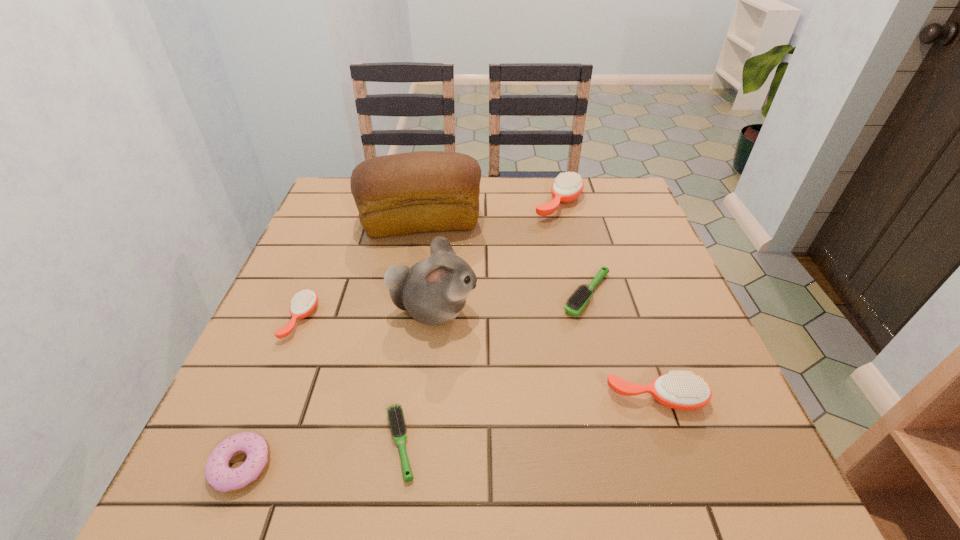
You are a GUI agent. You are given a task and a screenshot of the screen. Output one action in this format:
    pyautogui.click(x=<x>, y=<y>)
    Task: Click on the object positioned at the far left corner
    
    Given the screenshot: What is the action you would take?
    pyautogui.click(x=425, y=191)

Identify the location of object that is at the near left corner. The image size is (960, 540). (218, 474).

In order to click on object that is positioned at the far right corner in this screenshot , I will do `click(567, 186)`.

Find the location of a particular element. The width and height of the screenshot is (960, 540). free space at the far edge of the desktop is located at coordinates (489, 187).

In the image, there is a desktop. In order to click on vacant space at the near edge in this screenshot , I will do `click(334, 474)`.

The height and width of the screenshot is (540, 960). In order to click on vacant position at the left edge of the desktop in this screenshot , I will do `click(317, 388)`.

Where is `free spot at the right edge of the desktop`? free spot at the right edge of the desktop is located at coordinates (626, 299).

At what (x,y) coordinates should I click in order to perform the action: click on vacant space at the near right corner of the desktop. Please return your answer as a coordinate pair (x, y). Looking at the image, I should click on (780, 497).

Locate an element on the screen. free space between the doughnut and the hamster is located at coordinates (338, 388).

At what (x,y) coordinates should I click in order to perform the action: click on free spot between the white hamster and the nearest orange hairbrush. Please return your answer as a coordinate pair (x, y). The width and height of the screenshot is (960, 540). Looking at the image, I should click on (545, 355).